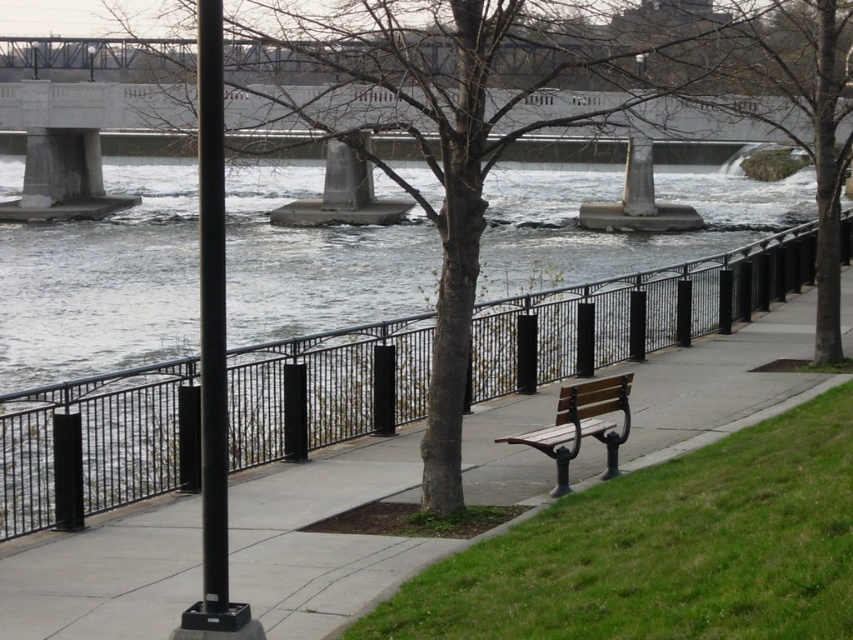
Question: Is black metal railing at center further to the viewer compared to wooden bench at center?

Choices:
 (A) yes
 (B) no

Answer: (B)

Question: Which of the following is the closest to the observer?

Choices:
 (A) (149, 483)
 (B) (447, 356)
 (C) (520, 435)

Answer: (B)

Question: Is black metal railing at center bigger than brown/dry bark tree at center?

Choices:
 (A) yes
 (B) no

Answer: (B)

Question: Does black metal railing at center appear on the left side of brown/dry bark tree at center?

Choices:
 (A) no
 (B) yes

Answer: (A)

Question: Which point appears closest to the camera in this image?

Choices:
 (A) (119, 461)
 (B) (640, 29)

Answer: (A)

Question: Estimate the real-world distances between objects in this image. Which object is farther from the black metal railing at center?

Choices:
 (A) wooden bench at center
 (B) brown/dry bark tree at center

Answer: (A)